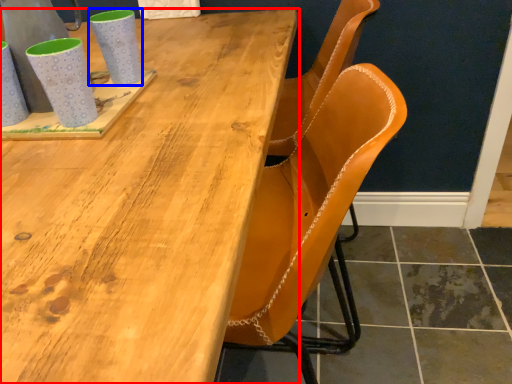
Question: Which of the following is the closest to the observer, table (highlighted by a red box) or mug (highlighted by a blue box)?

Choices:
 (A) table
 (B) mug

Answer: (A)